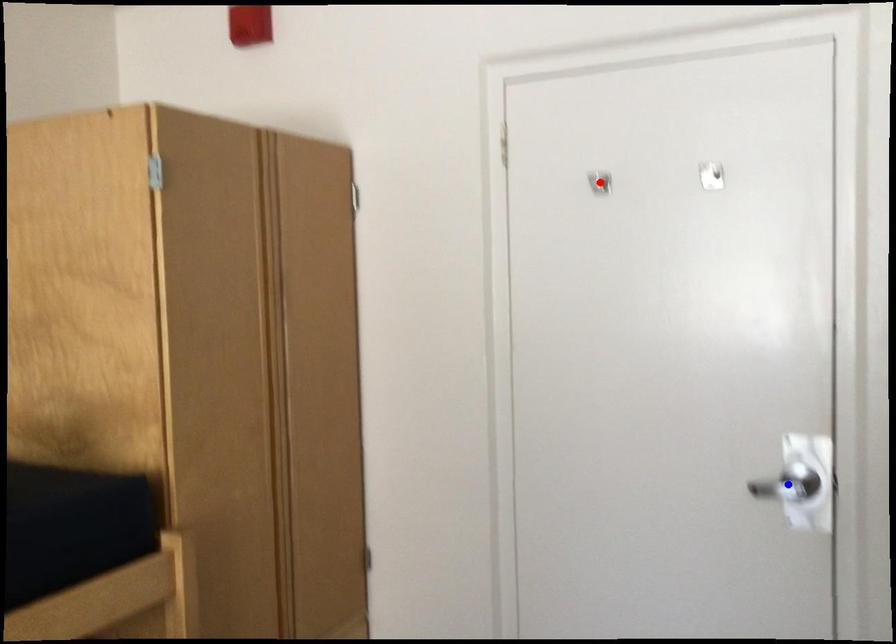
Question: In the image, two points are highlighted. Which point is nearer to the camera? Reply with the corresponding letter.

Choices:
 (A) blue point
 (B) red point

Answer: (A)